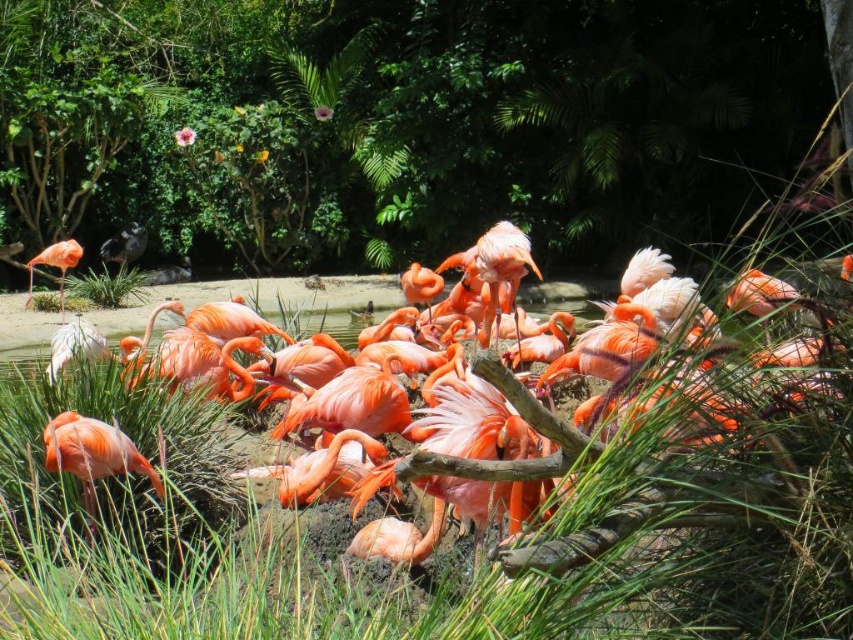
Question: Among these objects, which one is nearest to the camera?

Choices:
 (A) white matte bird at lower left
 (B) green grass at center

Answer: (B)

Question: Does matte pink flamingo at lower left appear on the left side of matte pink flamingo at left?

Choices:
 (A) no
 (B) yes

Answer: (A)

Question: Estimate the real-world distances between objects in this image. Which object is farther from the matte pink flamingo at lower left?

Choices:
 (A) white matte bird at lower left
 (B) matte gray bird at left
 (C) green grass at center

Answer: (B)

Question: Is the position of green grass at center less distant than that of white matte bird at lower left?

Choices:
 (A) no
 (B) yes

Answer: (B)

Question: Does matte pink flamingo at lower left appear over matte gray bird at left?

Choices:
 (A) no
 (B) yes

Answer: (A)

Question: Which point is farther to the camera?

Choices:
 (A) green leafy tree at upper center
 (B) matte pink flamingo at left

Answer: (A)